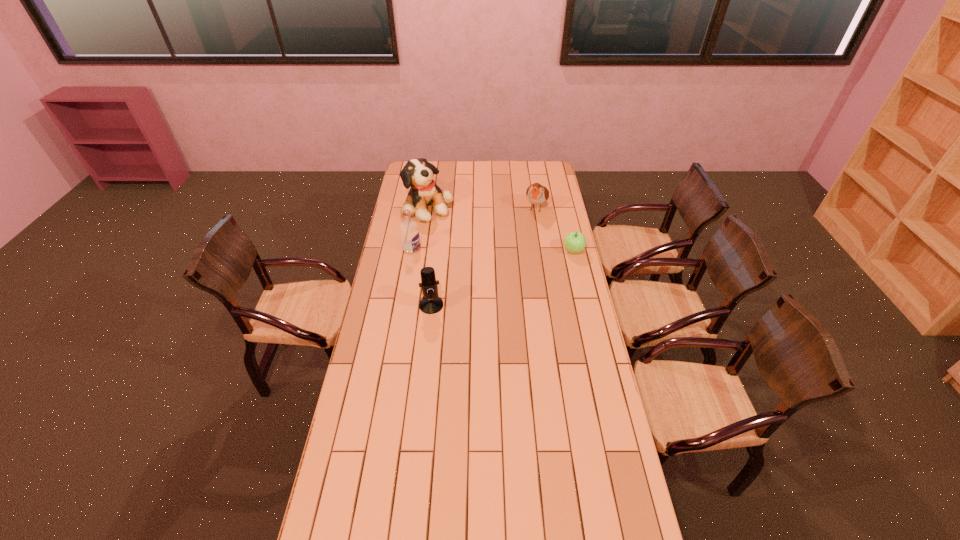
Locate an element on the screen. free space located at the face of the second object from right to left is located at coordinates pyautogui.click(x=525, y=239).

In order to click on free space located on the label of the vodka in this screenshot , I will do `click(431, 256)`.

Identify the location of free space located on the label of the vodka. Image resolution: width=960 pixels, height=540 pixels. (481, 275).

This screenshot has height=540, width=960. What are the coordinates of `vacant space positioned on the label of the vodka` in the screenshot? It's located at (436, 258).

The height and width of the screenshot is (540, 960). I want to click on free space located 0.140m at the face of the tallest object, so click(x=462, y=231).

What are the coordinates of `vacant region located 0.280m at the face of the tallest object` in the screenshot? It's located at (481, 243).

At what (x,y) coordinates should I click in order to perform the action: click on free space located at the face of the tallest object. Please return your answer as a coordinate pair (x, y). Looking at the image, I should click on (453, 225).

Locate an element on the screen. The width and height of the screenshot is (960, 540). vodka situated at the left edge is located at coordinates (409, 232).

Find the location of `puppy that is at the left edge`. puppy that is at the left edge is located at coordinates (418, 173).

You are a GUI agent. You are given a task and a screenshot of the screen. Output one action in this format:
    pyautogui.click(x=<x>, y=<y>)
    Task: Click on the apple that is at the right edge
    This screenshot has width=960, height=540.
    Given the screenshot: What is the action you would take?
    pyautogui.click(x=574, y=242)